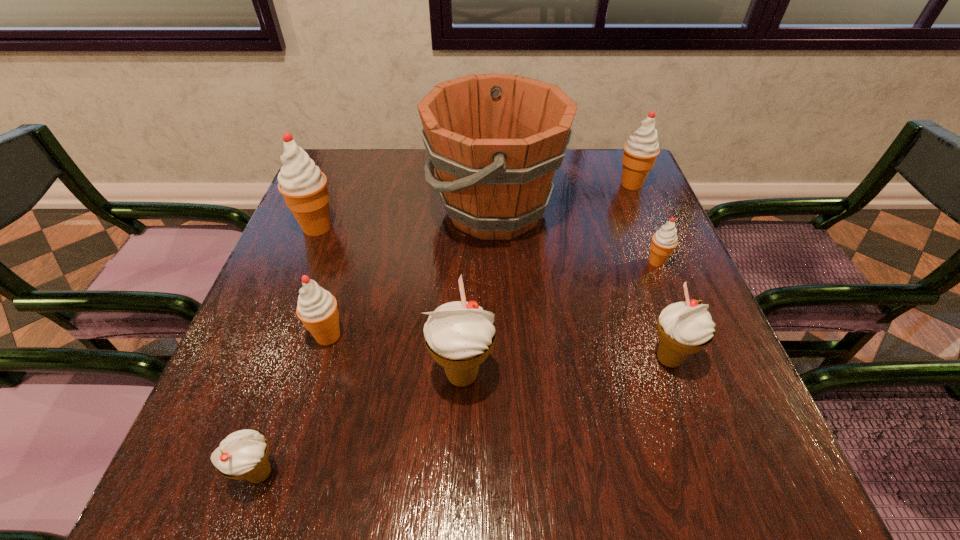
At what (x,y) coordinates should I click in order to perform the action: click on free region at the left edge of the desktop. Please return your answer as a coordinate pair (x, y). Looking at the image, I should click on (295, 363).

The width and height of the screenshot is (960, 540). In order to click on blank space at the right edge in this screenshot , I will do `click(697, 434)`.

You are a GUI agent. You are given a task and a screenshot of the screen. Output one action in this format:
    pyautogui.click(x=<x>, y=<y>)
    Task: Click on the free region at the near right corner
    Image resolution: width=960 pixels, height=540 pixels.
    Given the screenshot: What is the action you would take?
    pyautogui.click(x=698, y=443)

This screenshot has height=540, width=960. In order to click on free space between the bucket and the second smallest white icecream in this screenshot , I will do `click(582, 284)`.

Find the location of a particular element. This screenshot has width=960, height=540. free space between the sixth nearest icecream and the second biggest white icecream is located at coordinates (492, 293).

Where is `free space that is in between the third smallest red icecream and the second smallest white icecream`? The width and height of the screenshot is (960, 540). free space that is in between the third smallest red icecream and the second smallest white icecream is located at coordinates (650, 272).

Find the location of a particular element. free space between the second biggest white icecream and the bucket is located at coordinates (582, 284).

Locate an element on the screen. This screenshot has height=540, width=960. empty location between the bucket and the rightmost white icecream is located at coordinates (582, 284).

Where is `unoccupied position between the fourth icecream from left to right and the second biggest red icecream`? The image size is (960, 540). unoccupied position between the fourth icecream from left to right and the second biggest red icecream is located at coordinates (547, 279).

Where is `object that is the seventh closest to the farthest icecream`? The height and width of the screenshot is (540, 960). object that is the seventh closest to the farthest icecream is located at coordinates (243, 454).